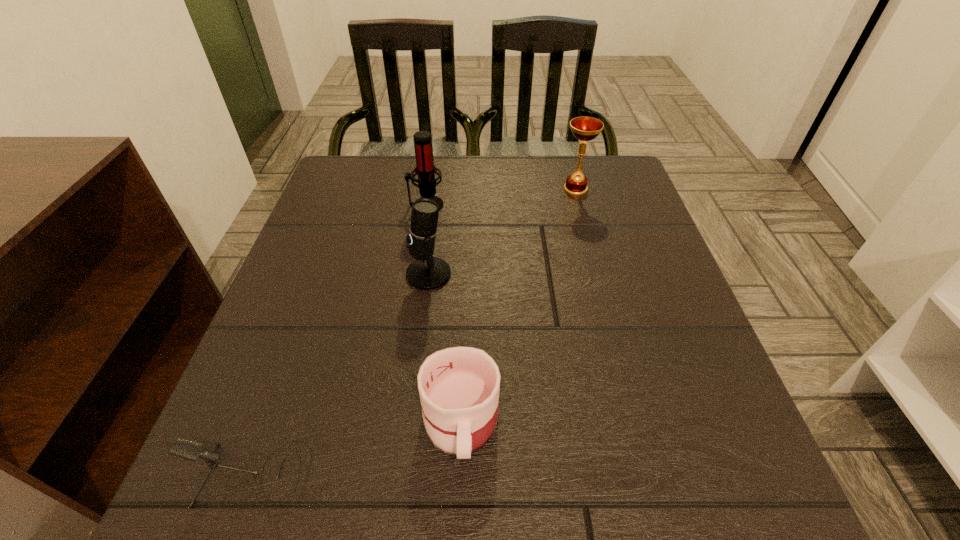
Find the location of a particular element. The image size is (960, 540). microphone at the far edge is located at coordinates (426, 171).

Locate an element on the screen. The width and height of the screenshot is (960, 540). chalice positioned at the far edge is located at coordinates (583, 128).

Where is `mug present at the near edge`? This screenshot has width=960, height=540. mug present at the near edge is located at coordinates (459, 387).

The height and width of the screenshot is (540, 960). I want to click on microphone that is at the near edge, so click(x=191, y=450).

This screenshot has width=960, height=540. In order to click on object located at the left edge in this screenshot , I will do `click(191, 450)`.

Where is `object that is at the right edge`? This screenshot has width=960, height=540. object that is at the right edge is located at coordinates (583, 128).

This screenshot has height=540, width=960. Find the location of `object at the near left corner`. object at the near left corner is located at coordinates (191, 450).

Locate an element on the screen. The width and height of the screenshot is (960, 540). object that is positioned at the far right corner is located at coordinates 583,128.

Find the location of `vacant space at the far edge of the desktop`. vacant space at the far edge of the desktop is located at coordinates (496, 193).

Locate an element on the screen. Image resolution: width=960 pixels, height=540 pixels. vacant area at the near edge of the desktop is located at coordinates 604,465.